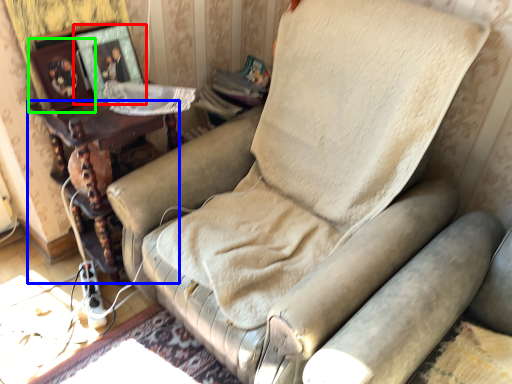
Question: Considering the real-world distances, which object is closest to picture frame (highlighted by a red box)? furniture (highlighted by a blue box) or picture frame (highlighted by a green box).

Choices:
 (A) furniture
 (B) picture frame

Answer: (B)